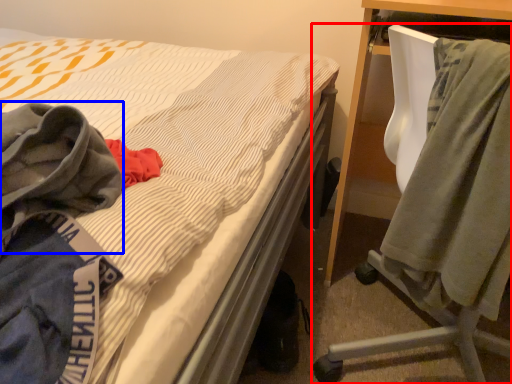
Question: Which object is closer to the camera taking this photo, chair (highlighted by a red box) or cloak (highlighted by a blue box)?

Choices:
 (A) chair
 (B) cloak

Answer: (B)